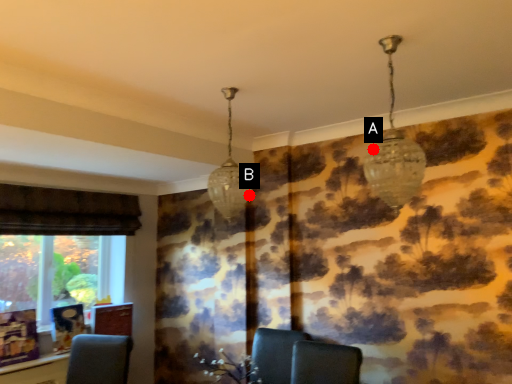
Question: Two points are circled on the image, labeled by A and B beside each circle. Among these points, which one is farthest from the camera?

Choices:
 (A) A is further
 (B) B is further

Answer: (B)